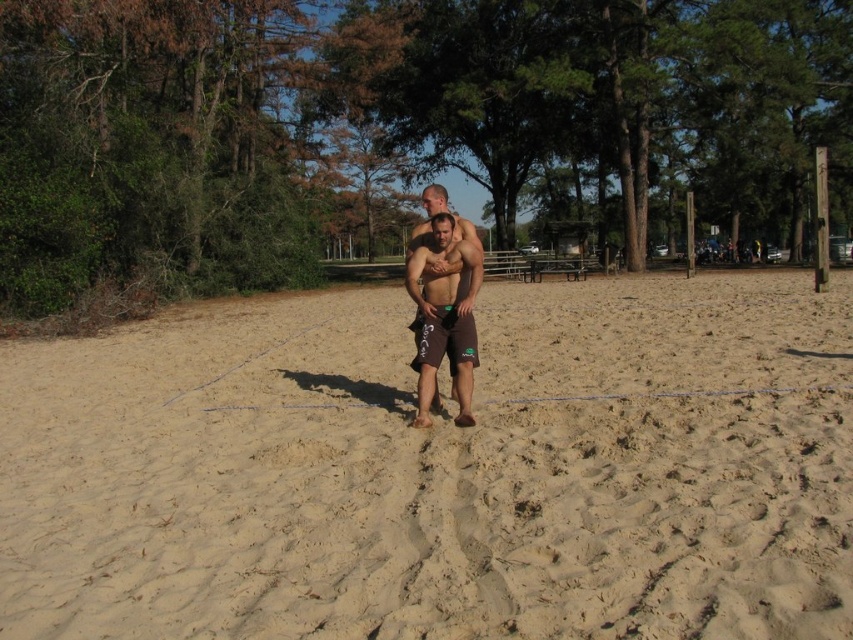
Between beige sandy beach at center and brown matte shorts at center, which one is positioned lower?

beige sandy beach at center is lower down.

Where is `beige sandy beach at center`? beige sandy beach at center is located at coordinates (440, 472).